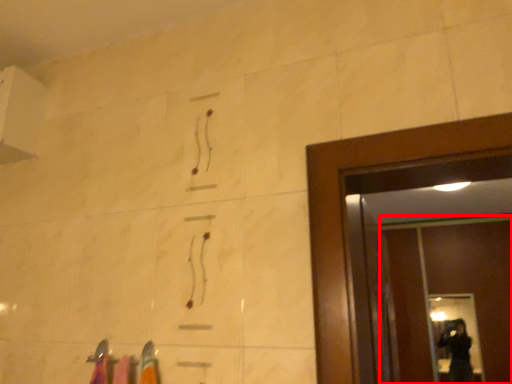
Question: From the image's perspective, what is the correct spatial relationship of screen door (annotated by the red box) in relation to glass door?

Choices:
 (A) above
 (B) below

Answer: (A)